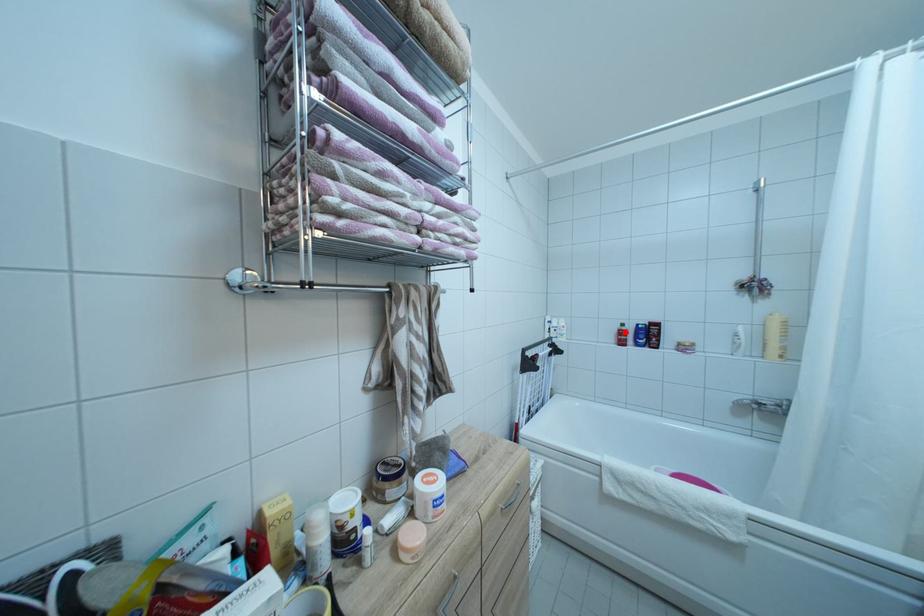
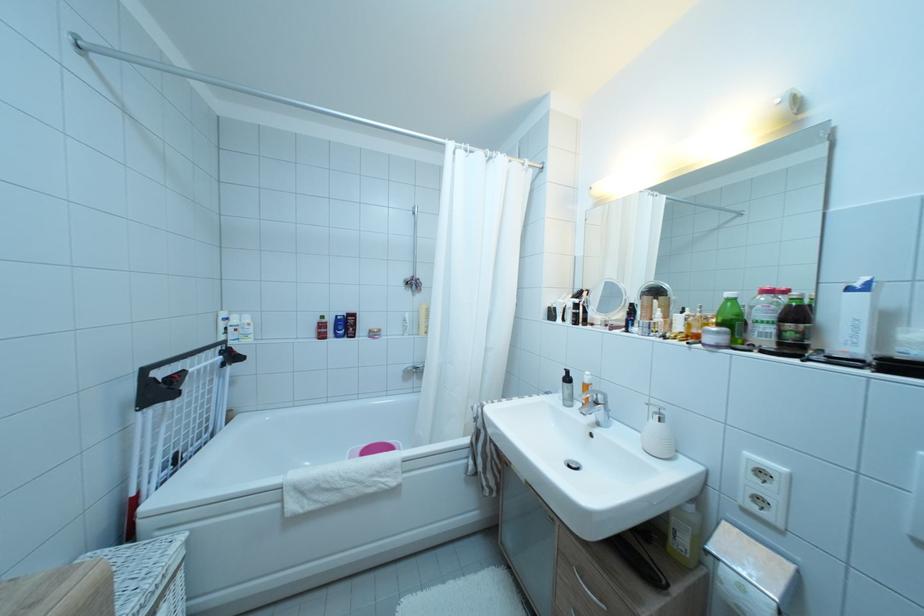
Question: I am providing you with two images of the same scene from different viewpoints. In image1, a red point is highlighted. Considering the same 3D point in image2, which of the following is correct?

Choices:
 (A) It is closer
 (B) It is farther

Answer: (B)